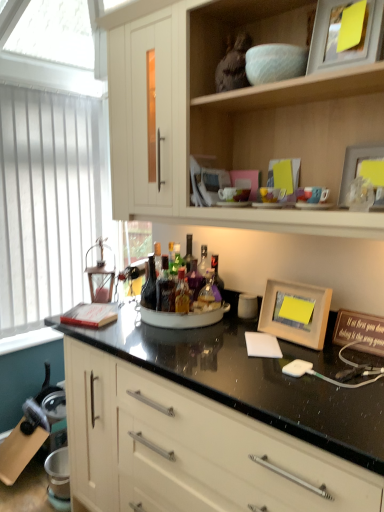
Describe the element at coordinates (190, 449) in the screenshot. This screenshot has height=512, width=384. I see `black granite countertop at center, which ranks as the 1th cabinetry in bottom-to-top order` at that location.

Identify the location of translucent glass bottle at center, arranged as the first bottle when viewed from the left. Image resolution: width=384 pixels, height=512 pixels. (149, 286).

The image size is (384, 512). Describe the element at coordinates (236, 116) in the screenshot. I see `light wood cabinet at upper center, the 1th cabinetry from the top` at that location.

Locate an element on the screen. The height and width of the screenshot is (512, 384). wooden picture frame at upper right, the third picture frame when ordered from bottom to top is located at coordinates (338, 34).

In order to face white matte notepad at center, should I rotate leftwards or rightwards?

You should rotate right by 9.663 degrees.

What do you see at coordinates (295, 312) in the screenshot? The height and width of the screenshot is (512, 384). I see `wooden picture frame at center-right, which is the 3th picture frame from top to bottom` at bounding box center [295, 312].

Image resolution: width=384 pixels, height=512 pixels. I want to click on black granite countertop at center, positioned as the 2th cabinetry in top-to-bottom order, so click(190, 449).

Considering the sizes of wooden picture frame at center-right, which is the 3th picture frame from top to bottom, and wooden picture frame at upper right, the first picture frame when ordered from top to bottom, in the image, is wooden picture frame at center-right, which is the 3th picture frame from top to bottom, wider or thinner than wooden picture frame at upper right, the first picture frame when ordered from top to bottom,?

In the image, wooden picture frame at center-right, which is the 3th picture frame from top to bottom, appears to be wider than wooden picture frame at upper right, the first picture frame when ordered from top to bottom.

How different are the orientations of wooden picture frame at center-right, which appears as the 1th picture frame when ordered from the bottom, and wooden picture frame at upper right, the third picture frame when ordered from bottom to top, in degrees?

9.36 degrees separate the facing orientations of wooden picture frame at center-right, which appears as the 1th picture frame when ordered from the bottom, and wooden picture frame at upper right, the third picture frame when ordered from bottom to top.

Is wooden picture frame at center-right, which appears as the 1th picture frame when ordered from the bottom, looking in the opposite direction of wooden picture frame at upper right, the first picture frame when ordered from top to bottom?

No, wooden picture frame at upper right, the first picture frame when ordered from top to bottom, is not at the back of wooden picture frame at center-right, which appears as the 1th picture frame when ordered from the bottom.

From a real-world perspective, is wooden picture frame at center-right, which appears as the 1th picture frame when ordered from the bottom, located higher than wooden picture frame at upper right, the third picture frame when ordered from bottom to top?

No.

Does point (156, 467) lie behind point (254, 343)?

Yes, it is.

From a real-world perspective, which is physically below, black granite countertop at center, which ranks as the 1th cabinetry in bottom-to-top order, or white matte notepad at center?

From a 3D spatial view, black granite countertop at center, which ranks as the 1th cabinetry in bottom-to-top order, is below.

In the scene shown: Considering the sizes of objects black granite countertop at center, which ranks as the 1th cabinetry in bottom-to-top order, and white matte notepad at center in the image provided, who is wider, black granite countertop at center, which ranks as the 1th cabinetry in bottom-to-top order, or white matte notepad at center?

Wider between the two is black granite countertop at center, which ranks as the 1th cabinetry in bottom-to-top order.

What's the angular difference between black granite countertop at center, positioned as the 2th cabinetry in top-to-bottom order, and white matte notepad at center's facing directions?

There is a 38.7-degree angle between the facing directions of black granite countertop at center, positioned as the 2th cabinetry in top-to-bottom order, and white matte notepad at center.

Between black granite countertop at center, which ranks as the 1th cabinetry in bottom-to-top order, and wooden picture frame at upper right, the third picture frame when ordered from bottom to top, which one has smaller width?

wooden picture frame at upper right, the third picture frame when ordered from bottom to top, is thinner.

Based on their sizes in the image, would you say black granite countertop at center, positioned as the 2th cabinetry in top-to-bottom order, is bigger or smaller than wooden picture frame at upper right, the first picture frame when ordered from top to bottom?

Clearly, black granite countertop at center, positioned as the 2th cabinetry in top-to-bottom order, is larger in size than wooden picture frame at upper right, the first picture frame when ordered from top to bottom.

Looking at this image, choose the correct answer: Is black granite countertop at center, positioned as the 2th cabinetry in top-to-bottom order, inside wooden picture frame at upper right, the first picture frame when ordered from top to bottom, or outside it?

black granite countertop at center, positioned as the 2th cabinetry in top-to-bottom order, is spatially situated outside wooden picture frame at upper right, the first picture frame when ordered from top to bottom.

Is black granite countertop at center, which ranks as the 1th cabinetry in bottom-to-top order, behind wooden picture frame at upper right, the third picture frame when ordered from bottom to top?

No, it is in front of wooden picture frame at upper right, the third picture frame when ordered from bottom to top.

From a real-world perspective, is matte wooden picture frame at upper right, the 2th picture frame in the bottom-to-top sequence, beneath white vertical blinds at left?

No, from a real-world perspective, matte wooden picture frame at upper right, the 2th picture frame in the bottom-to-top sequence, is not beneath white vertical blinds at left.

How far apart are matte wooden picture frame at upper right, which is the second picture frame from top to bottom, and white vertical blinds at left?

matte wooden picture frame at upper right, which is the second picture frame from top to bottom, and white vertical blinds at left are 1.83 meters apart from each other.

Are matte wooden picture frame at upper right, which is the second picture frame from top to bottom, and white vertical blinds at left making contact?

matte wooden picture frame at upper right, which is the second picture frame from top to bottom, is not next to white vertical blinds at left, and they're not touching.

Would you say matte wooden picture frame at upper right, which is the second picture frame from top to bottom, is inside or outside white vertical blinds at left?

matte wooden picture frame at upper right, which is the second picture frame from top to bottom, is located beyond the bounds of white vertical blinds at left.

How distant is translucent glass bottles at center, the second bottle in the right-to-left sequence, from white matte notepad at center?

translucent glass bottles at center, the second bottle in the right-to-left sequence, and white matte notepad at center are 16.22 inches apart.

Is point (168, 279) positioned in front of point (266, 337)?

No, (168, 279) is behind (266, 337).

Between translucent glass bottles at center, the 2th bottle when ordered from left to right, and white matte notepad at center, which one has more height?

With more height is translucent glass bottles at center, the 2th bottle when ordered from left to right.

From a real-world perspective, relative to white matte notepad at center, is translucent glass bottles at center, the second bottle in the right-to-left sequence, vertically above or below?

translucent glass bottles at center, the second bottle in the right-to-left sequence, is situated higher than white matte notepad at center in the real world.

Between light wood cabinet at upper center, which ranks as the 2th cabinetry in bottom-to-top order, and wooden picture frame at center-right, which appears as the 1th picture frame when ordered from the bottom, which one appears on the right side from the viewer's perspective?

Positioned to the right is wooden picture frame at center-right, which appears as the 1th picture frame when ordered from the bottom.

How much distance is there between light wood cabinet at upper center, the 1th cabinetry from the top, and wooden picture frame at center-right, which is the 3th picture frame from top to bottom?

23.87 inches.

Consider the image. Is light wood cabinet at upper center, the 1th cabinetry from the top, not close to wooden picture frame at center-right, which appears as the 1th picture frame when ordered from the bottom?

No, light wood cabinet at upper center, the 1th cabinetry from the top, is not far away from wooden picture frame at center-right, which appears as the 1th picture frame when ordered from the bottom.

Identify the location of the 2nd picture frame below when counting from the light wood cabinet at upper center, which ranks as the 2th cabinetry in bottom-to-top order (from the image's perspective). The image size is (384, 512). (295, 312).

Consider the image. Could you tell me if white vertical blinds at left is turned towards light wood cabinet at upper center, the 1th cabinetry from the top?

Yes.

Can you confirm if white vertical blinds at left is taller than light wood cabinet at upper center, the 1th cabinetry from the top?

Indeed, white vertical blinds at left has a greater height compared to light wood cabinet at upper center, the 1th cabinetry from the top.

Is white vertical blinds at left not close to light wood cabinet at upper center, the 1th cabinetry from the top?

Yes, white vertical blinds at left is far from light wood cabinet at upper center, the 1th cabinetry from the top.

From a real-world perspective, which is physically below, white vertical blinds at left or light wood cabinet at upper center, which ranks as the 2th cabinetry in bottom-to-top order?

white vertical blinds at left is physically lower.

The image size is (384, 512). What are the coordinates of `picture frame that is the 1st one when counting rightward from the wooden picture frame at center-right, which is the 3th picture frame from top to bottom` in the screenshot? It's located at (338, 34).

Find the location of a particular element. notepad above the black granite countertop at center, which ranks as the 1th cabinetry in bottom-to-top order (from a real-world perspective) is located at coordinates (262, 345).

When comparing their distances from black granite countertop at center, positioned as the 2th cabinetry in top-to-bottom order, does white matte notepad at center or translucent glass bottle at center, which is the third bottle from right to left, seem closer?

Among the two, white matte notepad at center is located nearer to black granite countertop at center, positioned as the 2th cabinetry in top-to-bottom order.

Looking at the image, which one is located closer to translucent glass bottle at center, the 1th bottle from the right, white matte notepad at center or wooden picture frame at upper right, the first picture frame when ordered from top to bottom?

white matte notepad at center.

Which object lies further to the anchor point matte wooden picture frame at upper right, which is the second picture frame from top to bottom, translucent glass bottle at center, the 3th bottle from the left, or wooden picture frame at center-right, which appears as the 1th picture frame when ordered from the bottom?

Among the two, translucent glass bottle at center, the 3th bottle from the left, is located further to matte wooden picture frame at upper right, which is the second picture frame from top to bottom.

Which object lies nearer to the anchor point matte wooden picture frame at upper right, the 2th picture frame in the bottom-to-top sequence, translucent glass bottle at center, which is the third bottle from right to left, or wooden picture frame at upper right, the first picture frame when ordered from top to bottom?

wooden picture frame at upper right, the first picture frame when ordered from top to bottom, lies closer to matte wooden picture frame at upper right, the 2th picture frame in the bottom-to-top sequence, than the other object.

When comparing their distances from translucent glass bottle at center, the 3th bottle from the left, does white vertical blinds at left or white matte notepad at center seem closer?

white matte notepad at center is closer to translucent glass bottle at center, the 3th bottle from the left.

Which object lies further to the anchor point translucent glass bottle at center, the 1th bottle from the right, white vertical blinds at left or matte wooden picture frame at upper right, which is the second picture frame from top to bottom?

white vertical blinds at left is further to translucent glass bottle at center, the 1th bottle from the right.

Which object lies further to the anchor point black granite countertop at center, positioned as the 2th cabinetry in top-to-bottom order, white matte notepad at center or wooden picture frame at upper right, the third picture frame when ordered from bottom to top?

wooden picture frame at upper right, the third picture frame when ordered from bottom to top, lies further to black granite countertop at center, positioned as the 2th cabinetry in top-to-bottom order, than the other object.

Considering their positions, is wooden picture frame at center-right, which appears as the 1th picture frame when ordered from the bottom, positioned further to translucent glass bottle at center, the 3th bottle from the left, than wooden picture frame at upper right, the first picture frame when ordered from top to bottom?

wooden picture frame at upper right, the first picture frame when ordered from top to bottom, lies further to translucent glass bottle at center, the 3th bottle from the left, than the other object.

What are the coordinates of `cabinetry between wooden picture frame at upper right, the first picture frame when ordered from top to bottom, and translucent glass bottle at center, the 3th bottle from the left, from top to bottom` in the screenshot? It's located at (236, 116).

This screenshot has width=384, height=512. I want to click on notepad between wooden picture frame at upper right, the third picture frame when ordered from bottom to top, and black granite countertop at center, which ranks as the 1th cabinetry in bottom-to-top order, vertically, so click(262, 345).

Find the location of a particular element. The height and width of the screenshot is (512, 384). notepad located between translucent glass bottle at center, which is the third bottle from right to left, and wooden picture frame at center-right, which appears as the 1th picture frame when ordered from the bottom, in the left-right direction is located at coordinates (x=262, y=345).

This screenshot has width=384, height=512. I want to click on notepad located between black granite countertop at center, which ranks as the 1th cabinetry in bottom-to-top order, and wooden picture frame at center-right, which appears as the 1th picture frame when ordered from the bottom, in the depth direction, so coord(262,345).